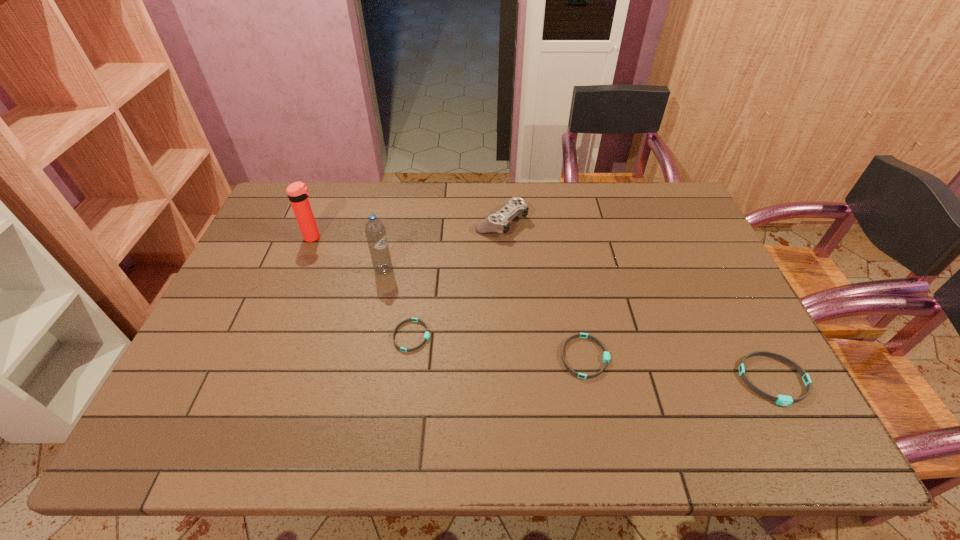
You are a GUI agent. You are given a task and a screenshot of the screen. Output one action in this format:
    pyautogui.click(x=<x>, y=<y>)
    Task: Click on the third farthest object
    
    Given the screenshot: What is the action you would take?
    pyautogui.click(x=375, y=231)

Image resolution: width=960 pixels, height=540 pixels. I want to click on free space located 0.190m on the buckle of the shortest object, so click(x=505, y=336).

Where is `blank space located 0.140m on the buckle of the second object from right to left`? The height and width of the screenshot is (540, 960). blank space located 0.140m on the buckle of the second object from right to left is located at coordinates (666, 357).

What are the coordinates of `vacant space positioned 0.270m on the right of the thermos bottle` in the screenshot? It's located at click(409, 238).

Locate an element on the screen. The image size is (960, 540). vacant position located on the right of the third object from right to left is located at coordinates (629, 222).

This screenshot has width=960, height=540. Find the location of `vacant space located 0.260m on the left of the fifth object from right to left`. vacant space located 0.260m on the left of the fifth object from right to left is located at coordinates [285, 270].

The image size is (960, 540). What are the coordinates of `object present at the far edge` in the screenshot? It's located at (498, 222).

In order to click on object present at the left edge in this screenshot , I will do `click(297, 192)`.

Locate an element on the screen. object that is at the right edge is located at coordinates (783, 400).

Find the location of `object that is at the near right corner`. object that is at the near right corner is located at coordinates (783, 400).